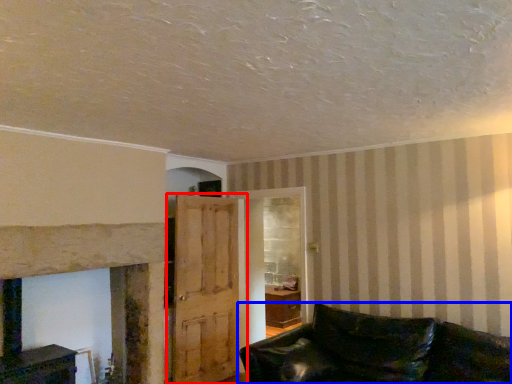
Question: Which point is further to the camera, door (highlighted by a red box) or studio couch (highlighted by a blue box)?

Choices:
 (A) door
 (B) studio couch

Answer: (A)